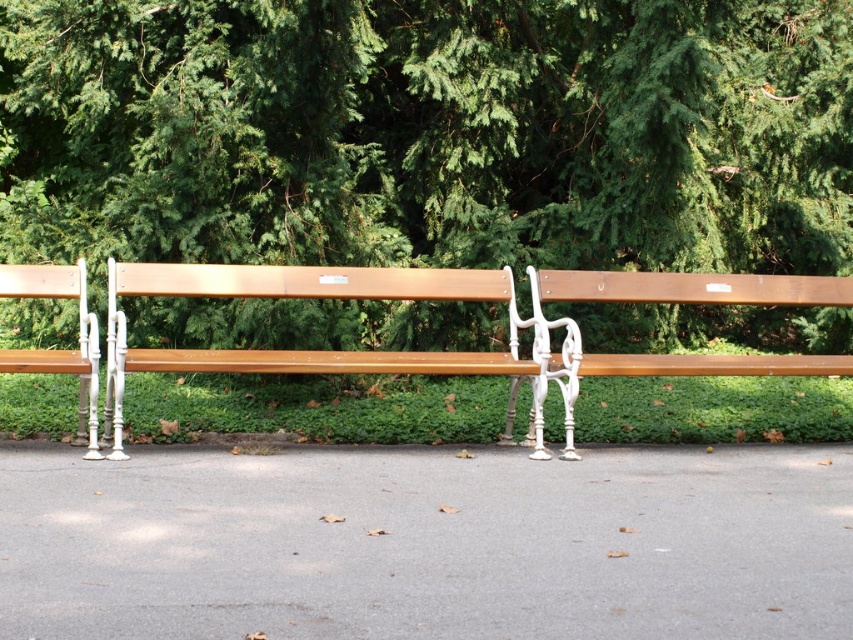
Question: Which object is closer to the camera taking this photo?

Choices:
 (A) green leafy tree at upper center
 (B) matte wood bench at right
 (C) matte wood bench at left
 (D) wooden bench at center

Answer: (C)

Question: Does green leafy tree at upper center appear under matte wood bench at right?

Choices:
 (A) no
 (B) yes

Answer: (A)

Question: Does green leafy tree at upper center appear over matte wood bench at right?

Choices:
 (A) yes
 (B) no

Answer: (A)

Question: Among these objects, which one is farthest from the camera?

Choices:
 (A) wooden bench at center
 (B) green leafy tree at upper center
 (C) matte wood bench at left

Answer: (B)

Question: Does wooden bench at center appear on the left side of matte wood bench at left?

Choices:
 (A) yes
 (B) no

Answer: (B)

Question: Which point is closer to the camera?

Choices:
 (A) wooden bench at center
 (B) matte wood bench at right
 (C) matte wood bench at left

Answer: (C)